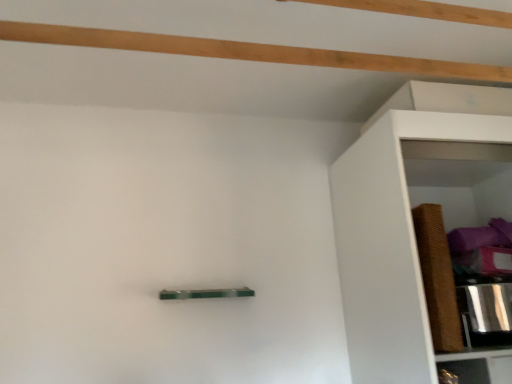
Locate an element on the screen. The image size is (512, 384). brown woven basket at right is located at coordinates (438, 278).

The image size is (512, 384). What do you see at coordinates (438, 278) in the screenshot?
I see `brown woven basket at right` at bounding box center [438, 278].

Measure the distance between point (431, 254) and camera.

Point (431, 254) is 4.06 feet away from camera.

This screenshot has width=512, height=384. I want to click on brown woven basket at right, so click(x=438, y=278).